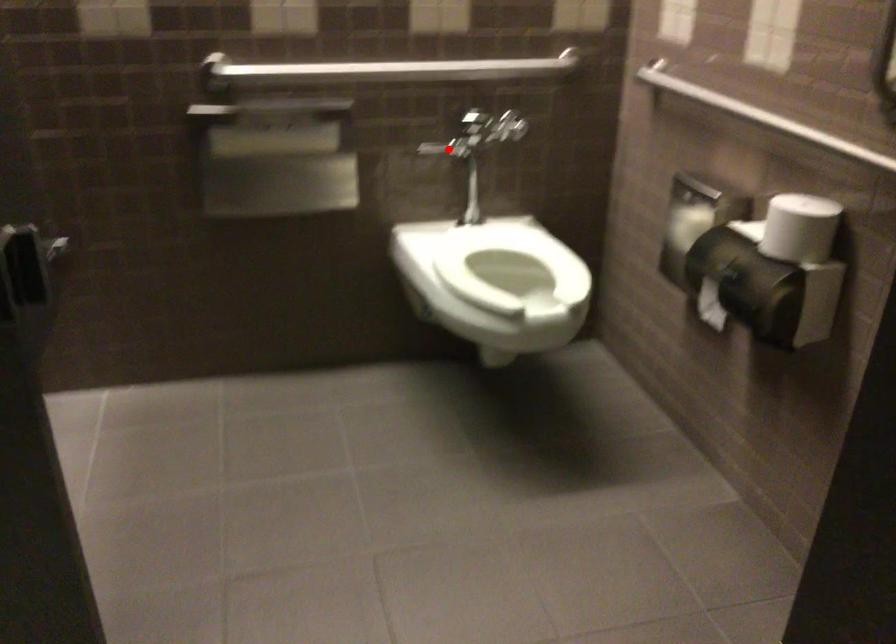
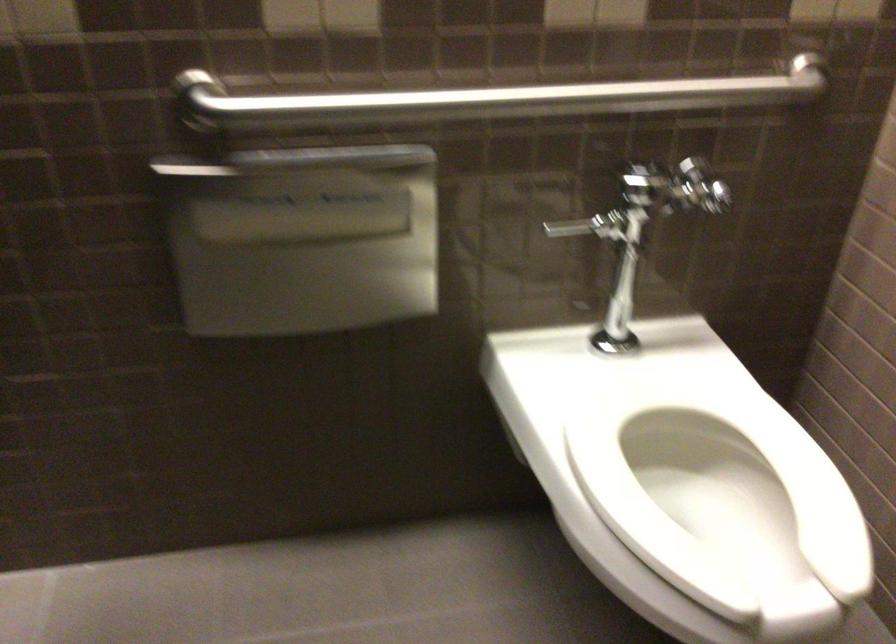
Question: I am providing you with two images of the same scene from different viewpoints. Given a red point in image1, look at the same physical point in image2. Is it:

Choices:
 (A) Closer to the viewpoint
 (B) Farther from the viewpoint

Answer: (A)